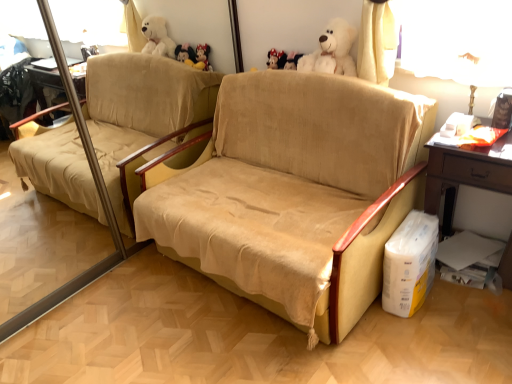
Find the location of a particular element. This screenshot has height=384, width=512. free space between beige suede couch at center and wooden table at right is located at coordinates (423, 326).